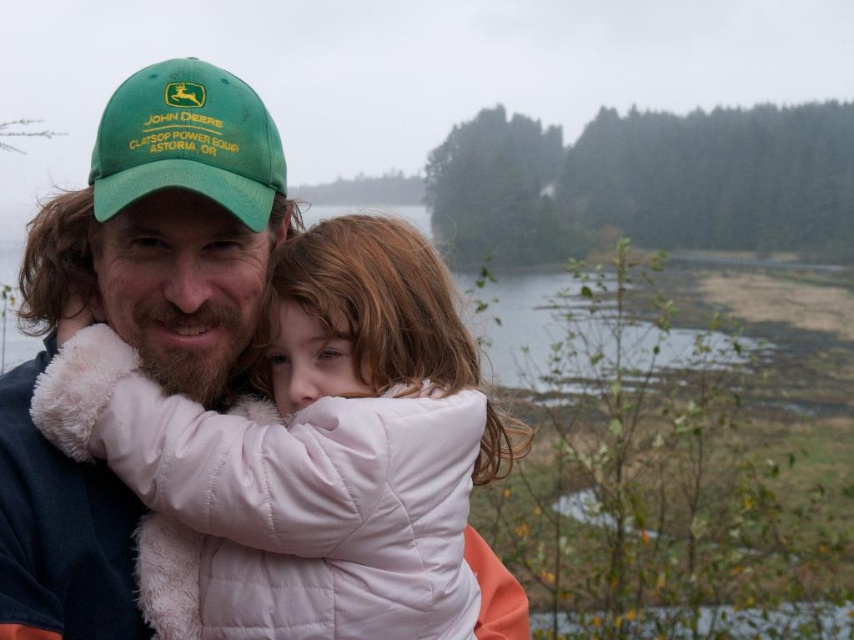
Does white puffy jacket at center have a lesser height compared to green fabric baseball cap at upper left?

In fact, white puffy jacket at center may be taller than green fabric baseball cap at upper left.

Is white puffy jacket at center above green fabric baseball cap at upper left?

Actually, white puffy jacket at center is below green fabric baseball cap at upper left.

Identify the location of white puffy jacket at center. (307, 456).

This screenshot has height=640, width=854. Find the location of `white puffy jacket at center`. white puffy jacket at center is located at coordinates (307, 456).